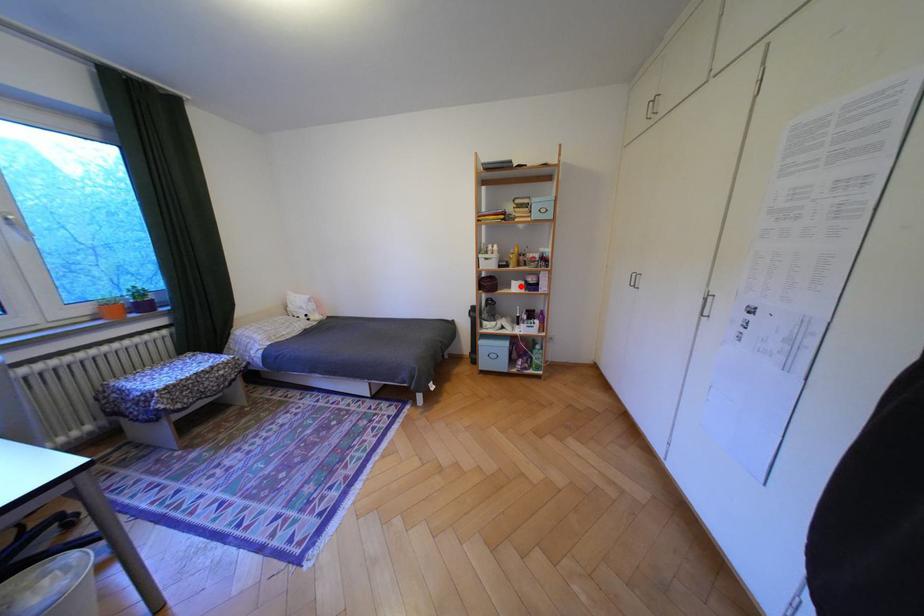
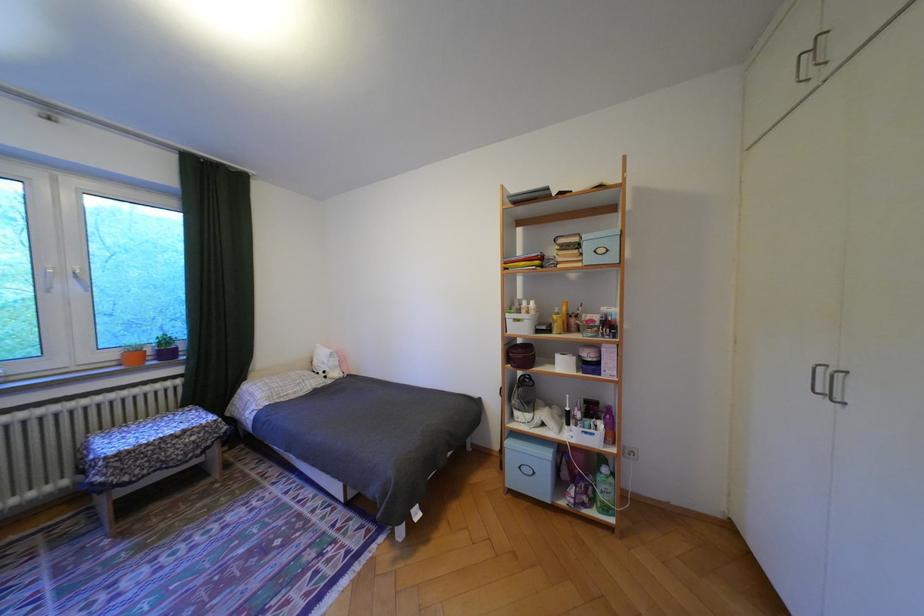
Where in the second image is the point corresponding to the highlighted location from the first image?

(564, 362)